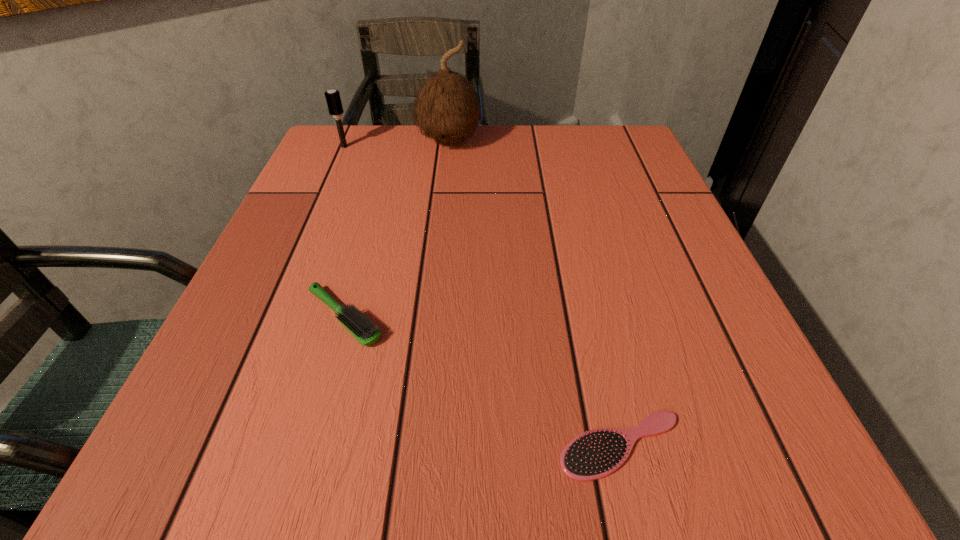
This screenshot has width=960, height=540. I want to click on free region located on the left of the shortest hairbrush, so click(x=467, y=445).

Identify the location of coconut that is at the far edge. (447, 110).

Image resolution: width=960 pixels, height=540 pixels. In order to click on hairbrush that is at the far edge in this screenshot , I will do `click(333, 98)`.

Identify the location of object that is positioned at the near edge. (593, 455).

You are a GUI agent. You are given a task and a screenshot of the screen. Output one action in this format:
    pyautogui.click(x=<x>, y=<y>)
    Task: Click on the object located at the right edge
    
    Given the screenshot: What is the action you would take?
    pyautogui.click(x=593, y=455)

I want to click on object situated at the far left corner, so click(x=333, y=98).

The width and height of the screenshot is (960, 540). I want to click on object present at the near right corner, so click(x=593, y=455).

In the image, there is a desktop. Where is `free space at the far edge`? free space at the far edge is located at coordinates 471,163.

This screenshot has height=540, width=960. In order to click on vacant space at the left edge of the desktop in this screenshot , I will do (344, 259).

In order to click on free space at the right edge in this screenshot , I will do `click(648, 338)`.